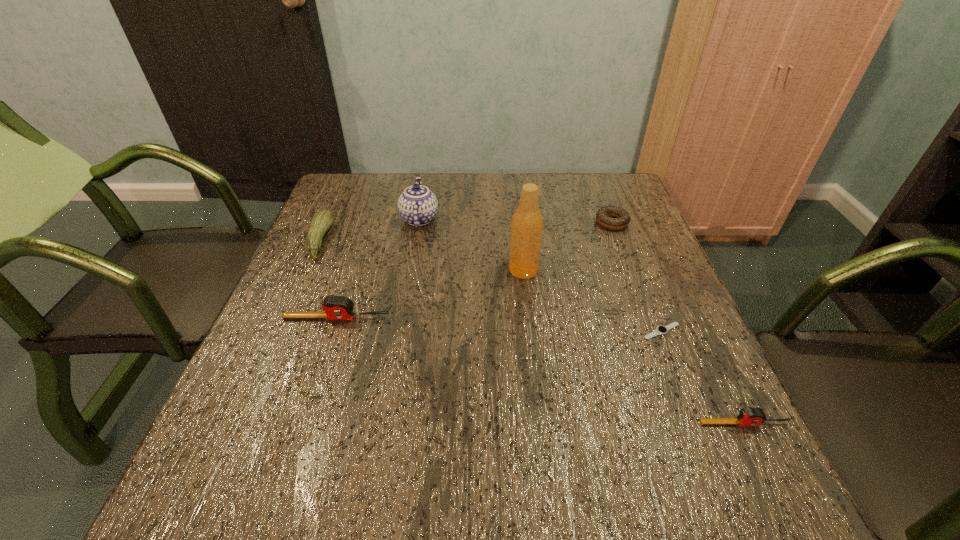
Find the location of `tape measure located at the left edge`. tape measure located at the left edge is located at coordinates (335, 307).

This screenshot has width=960, height=540. In order to click on zucchini that is at the left edge in this screenshot , I will do `click(321, 222)`.

At what (x,y) coordinates should I click in order to perform the action: click on tape measure situated at the right edge. Please return your answer as a coordinate pair (x, y). The height and width of the screenshot is (540, 960). Looking at the image, I should click on (749, 416).

Find the location of a particular element. Image resolution: width=960 pixels, height=540 pixels. doughnut positioned at the right edge is located at coordinates (604, 215).

At what (x,y) coordinates should I click in order to perform the action: click on watch at the right edge. Please return your answer as a coordinate pair (x, y). Looking at the image, I should click on (660, 330).

Image resolution: width=960 pixels, height=540 pixels. I want to click on object positioned at the far right corner, so click(604, 215).

Locate an element on the screen. The height and width of the screenshot is (540, 960). object that is at the near right corner is located at coordinates (749, 416).

Locate an element on the screen. The height and width of the screenshot is (540, 960). vacant space at the far edge of the desktop is located at coordinates (499, 202).

In the image, there is a desktop. Where is `free space at the near edge`? free space at the near edge is located at coordinates (498, 421).

You are a GUI agent. You are given a task and a screenshot of the screen. Output one action in this format:
    pyautogui.click(x=<x>, y=<y>)
    Task: Click on the free space at the left edge of the desktop
    The image size is (960, 540).
    Given the screenshot: What is the action you would take?
    pyautogui.click(x=349, y=229)